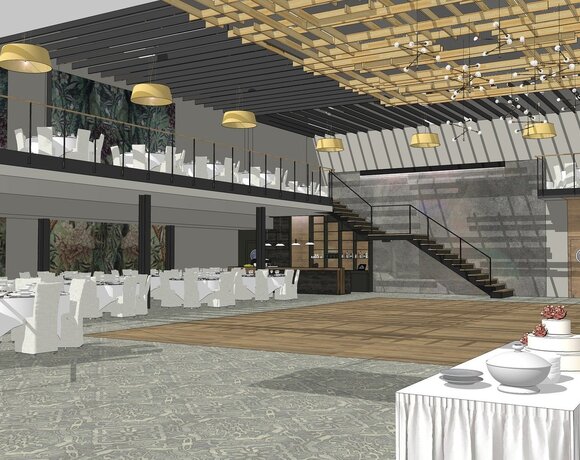
Find the location of a particular element. The width and height of the screenshot is (580, 460). hanging yellow lights is located at coordinates (41, 65), (154, 95), (234, 118), (322, 141), (429, 139), (532, 129).